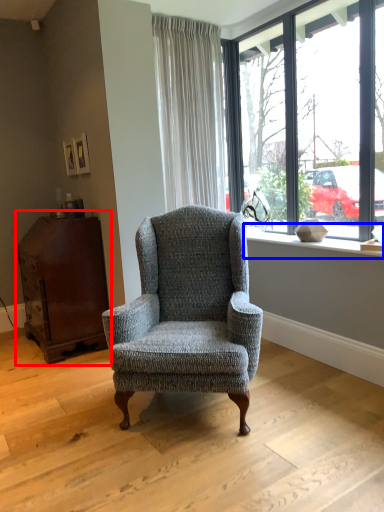
Question: Which object is further to the camera taking this photo, dresser (highlighted by a red box) or window sill (highlighted by a blue box)?

Choices:
 (A) dresser
 (B) window sill

Answer: (A)